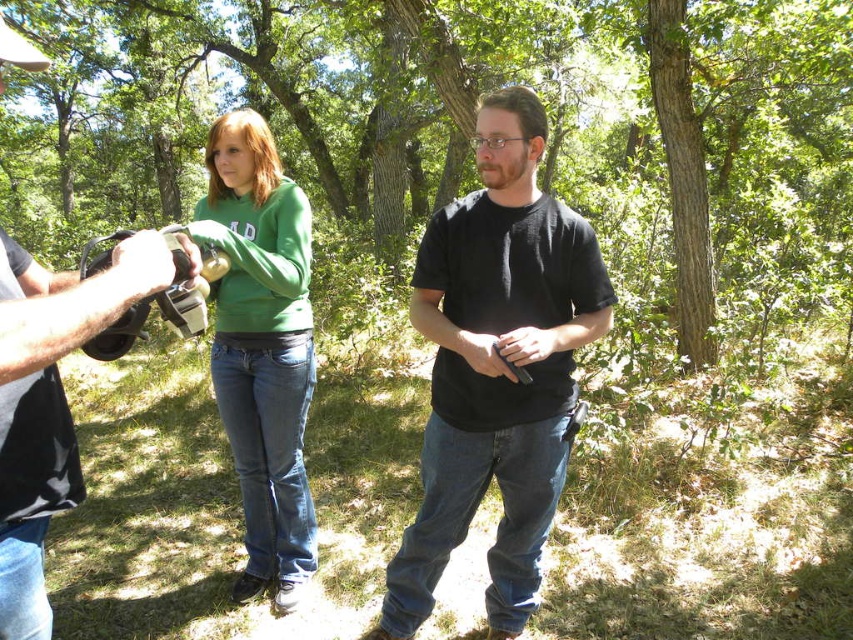
You are a photographer trying to capture a group photo of the two people in the scene. The green matte hoodie at center and the matte black camera at left are both in your viewfinder. Based on their positions, which object should you adjust to ensure both are fully visible in the frame?

The green matte hoodie at center is to the left of the matte black camera at left, so you should adjust the matte black camera at left to the right to ensure both are fully visible in the frame.

You are a photographer trying to capture a photo of the green matte hoodie at center and the brown textured tree at center. Which object should you focus on first if you want both to be in sharp focus?

The brown textured tree at center is larger than the green matte hoodie at center, so focusing on the tree first would ensure both are in focus as it occupies more of the frame.

You are standing at point (756,38) in the wooded area. You want to take a photo of the camera holder. Is the camera holder within your 10 meters range?

The distance between point (756,38) and the camera is 6.96 meters, so yes, the camera holder is within your 10 meters range.